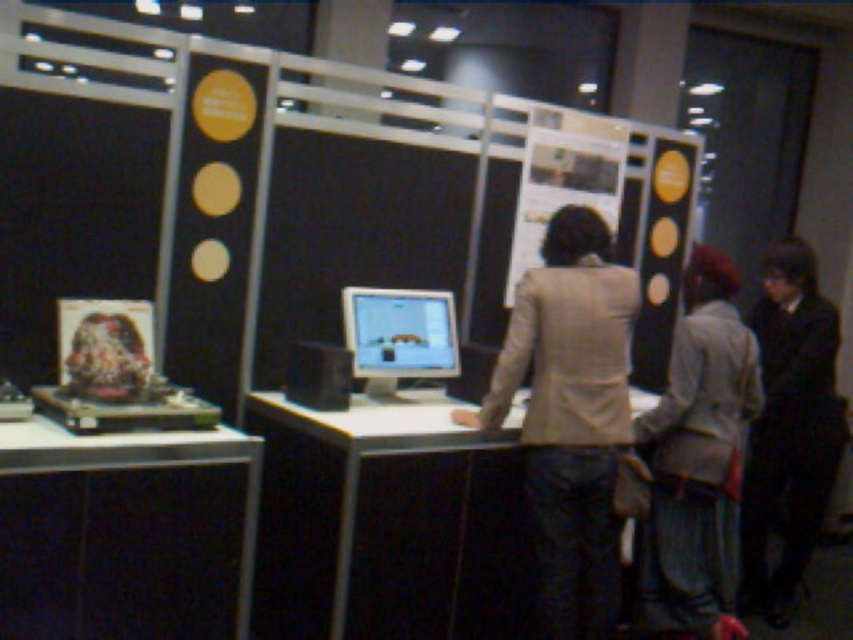
You are setting up a display at the exhibition booth and need to ensure that the metallic silver computer at center and the matte plastic monitor at center are arranged properly. Given their sizes, which object should be placed first to accommodate both items on the desk?

The metallic silver computer at center is larger in size than the matte plastic monitor at center, so you should place the metallic silver computer at center first to ensure there is enough space for both items on the desk.

You are a visitor at the exhibition booth and want to ask the person wearing the beige fabric jacket at center a question about the monitor. Which direction should you move relative to the matte plastic monitor at center to approach them?

The beige fabric jacket at center is to the right of the matte plastic monitor at center, so you should move to the right of the matte plastic monitor at center to approach them.